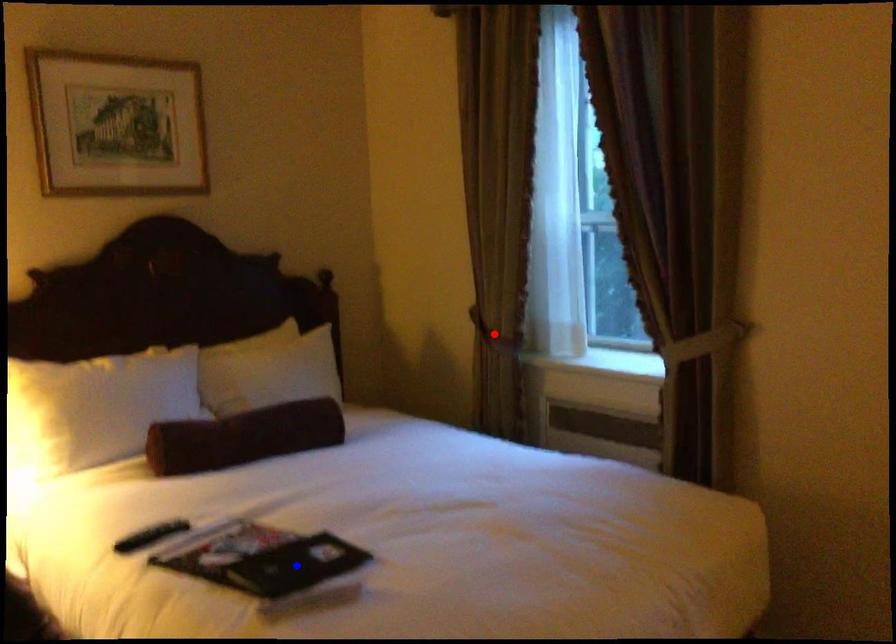
Question: In the image, two points are highlighted. Which point is nearer to the camera? Reply with the corresponding letter.

Choices:
 (A) blue point
 (B) red point

Answer: (A)